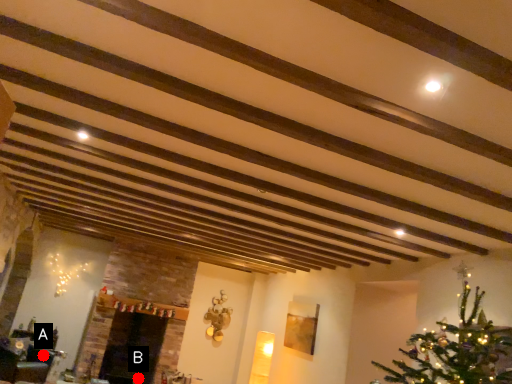
Question: Two points are circled on the image, labeled by A and B beside each circle. Among these points, which one is nearest to the camera?

Choices:
 (A) A is closer
 (B) B is closer

Answer: (A)